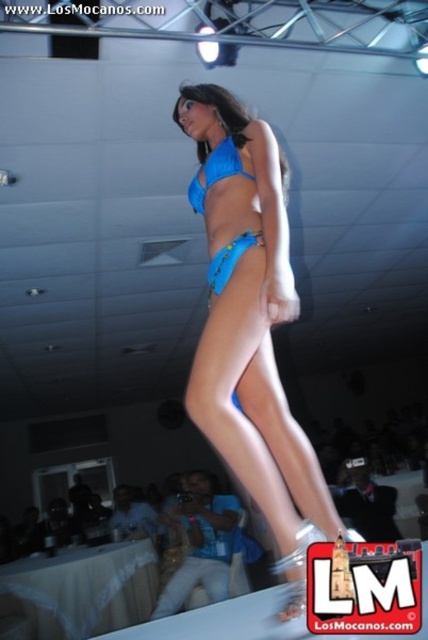
Question: Is blue shiny bikini at center smaller than blue matte bikini at center?

Choices:
 (A) yes
 (B) no

Answer: (B)

Question: Which point appears closest to the camera in this image?

Choices:
 (A) (193, 189)
 (B) (259, 193)
 (C) (229, 170)

Answer: (B)

Question: Considering the relative positions of blue shiny bikini at center and blue matte bikini at center in the image provided, where is blue shiny bikini at center located with respect to blue matte bikini at center?

Choices:
 (A) below
 (B) above

Answer: (A)

Question: In this image, where is blue shiny bikini at center located relative to blue matte bikini top at center?

Choices:
 (A) right
 (B) left

Answer: (A)

Question: Estimate the real-world distances between objects in this image. Which object is closer to the blue matte bikini top at center?

Choices:
 (A) blue shiny bikini at center
 (B) blue matte bikini at center

Answer: (B)

Question: Which of the following is the farthest from the observer?

Choices:
 (A) (288, 300)
 (B) (211, 260)

Answer: (B)